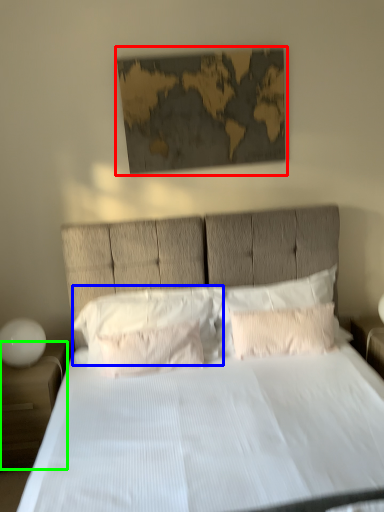
Question: Estimate the real-world distances between objects in this image. Which object is closer to picture frame (highlighted by a red box), pillow (highlighted by a blue box) or nightstand (highlighted by a green box)?

Choices:
 (A) pillow
 (B) nightstand

Answer: (A)